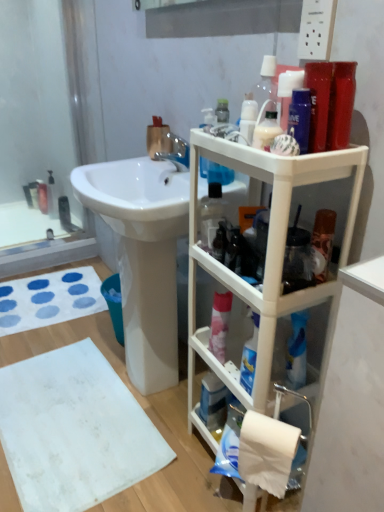
Question: Relative to white plastic shelf at right, is white matte bath towel at lower left, the first bath towel in the front-to-back sequence, in front or behind?

Choices:
 (A) front
 (B) behind

Answer: (B)

Question: From the image's perspective, is white matte bath towel at lower left, which appears as the second bath towel when viewed from the back, positioned above or below white plastic shelf at right?

Choices:
 (A) above
 (B) below

Answer: (B)

Question: Which object is the closest to the translucent plastic bottle at upper center?

Choices:
 (A) white glossy sink at center
 (B) clear glass bottle at upper left
 (C) white fabric bath towel at lower left, the 2th bath towel when ordered from front to back
 (D) blue plastic mouthwash at lower center
 (E) chrome metallic faucet at upper center

Answer: (E)

Question: Which is nearer to the clear glass bottle at upper left?

Choices:
 (A) white plastic shelf at right
 (B) translucent plastic bottle at upper center
 (C) white glossy sink at center
 (D) white matte bath towel at lower left, marked as the 2th bath towel in a top-to-bottom arrangement
 (E) white fabric bath towel at lower left, the 2th bath towel when ordered from front to back

Answer: (E)